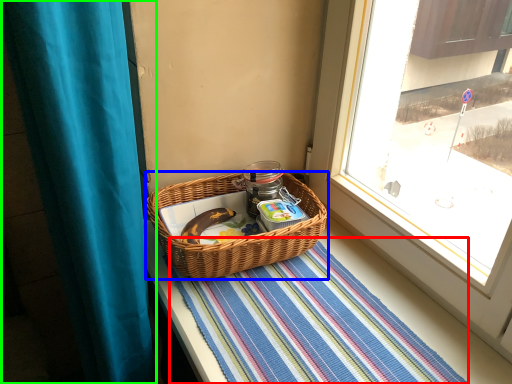
Question: Considering the real-world distances, which object is closest to mat (highlighted by a red box)? picnic basket (highlighted by a blue box) or curtain (highlighted by a green box).

Choices:
 (A) picnic basket
 (B) curtain

Answer: (A)